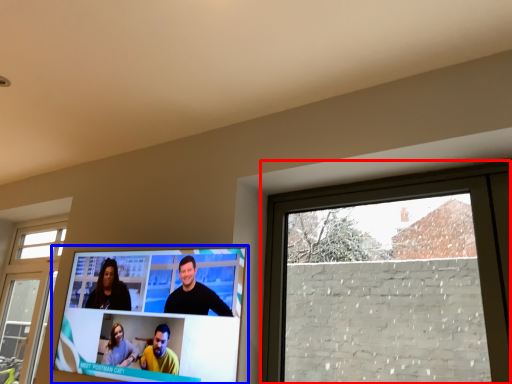
Question: Which object is further to the camera taking this photo, window (highlighted by a red box) or television (highlighted by a blue box)?

Choices:
 (A) window
 (B) television

Answer: (B)